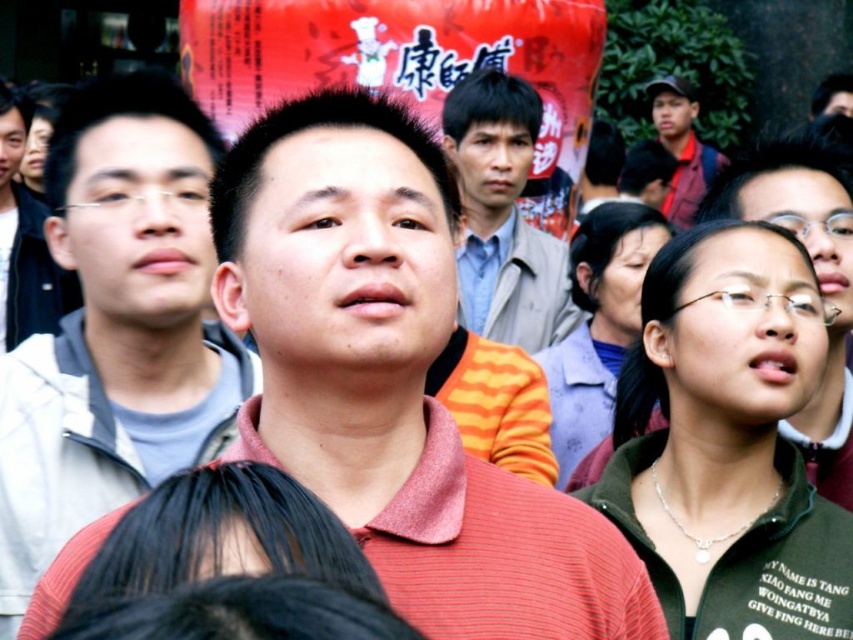
You are standing in the crowd at the event and want to locate the matte gray shirt at left. Based on the coordinates provided, can you determine its general location relative to the man in the red polo shirt?

The matte gray shirt at left is located at coordinates point (25, 237). Since the man in the red polo shirt is in the foreground, the matte gray shirt at left is positioned to the left side of the image and slightly lower down compared to him.

You are standing at the viewing position and want to hand a document to the person wearing the matte gray shirt at left. Considering the distance, can you throw the document to them without moving from your current position?

The matte gray shirt at left is 67.35 meters from viewer. Since this distance is quite far, it would be challenging to accurately throw a document that distance without potentially missing or the paper being blown away by wind. It would be more practical to approach closer or ask someone else to relay the document.